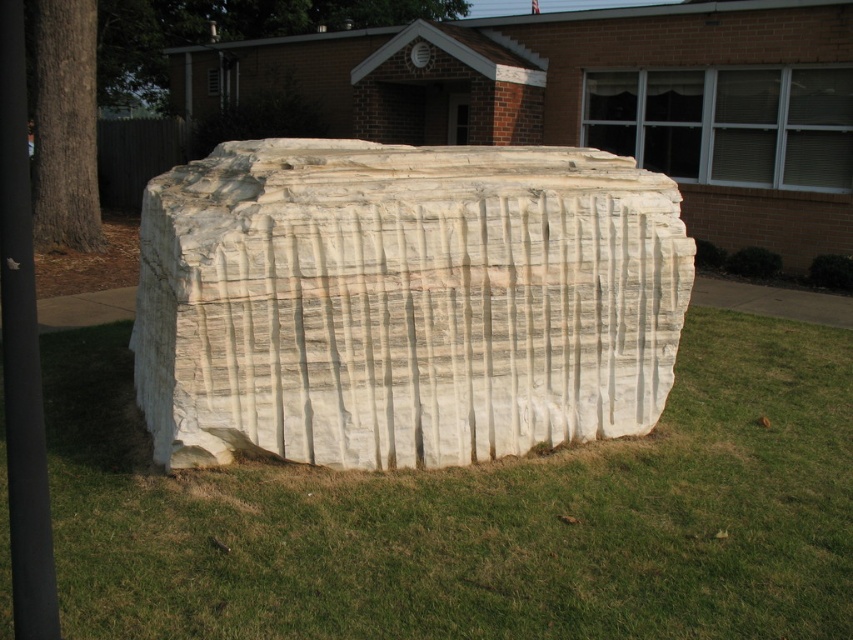
Can you confirm if green grass at lower center is wider than black plastic pole at left?

Yes.

Where is `green grass at lower center`? green grass at lower center is located at coordinates (476, 515).

Between point (106, 449) and point (370, 218), which one is positioned in front?

Point (370, 218) is in front.

The width and height of the screenshot is (853, 640). I want to click on green grass at lower center, so click(476, 515).

Can you confirm if white marble rock at center is positioned to the right of black plastic pole at left?

Indeed, white marble rock at center is positioned on the right side of black plastic pole at left.

Measure the distance from white marble rock at center to black plastic pole at left.

white marble rock at center and black plastic pole at left are 2.02 meters apart.

The image size is (853, 640). Identify the location of white marble rock at center. (403, 301).

This screenshot has width=853, height=640. In order to click on white marble rock at center in this screenshot , I will do `click(403, 301)`.